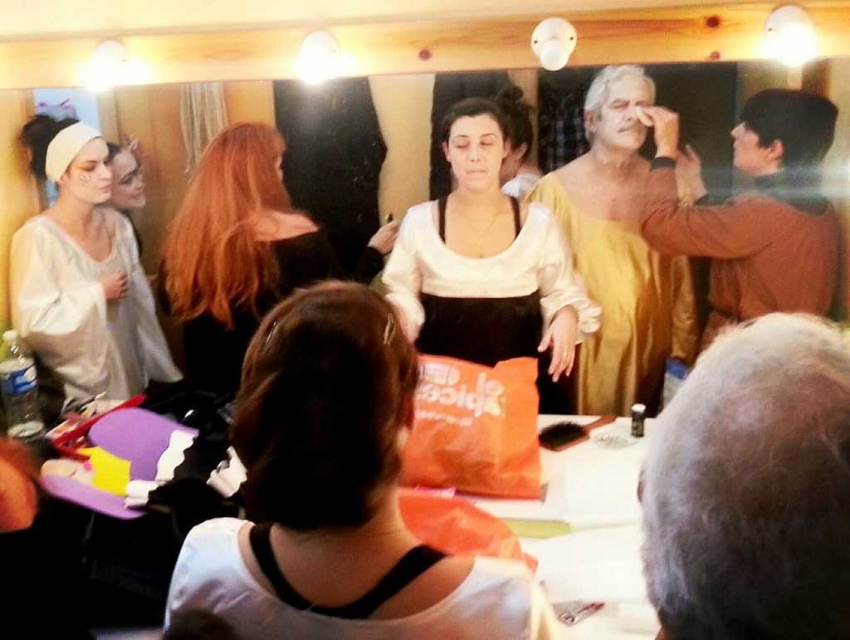
Question: Which object is farther from the camera taking this photo?

Choices:
 (A) white matte apron at center
 (B) black satin dress at center

Answer: (B)

Question: Which point is closer to the camera?

Choices:
 (A) (256, 296)
 (B) (429, 317)
 (C) (207, 548)

Answer: (C)

Question: Is white matte apron at center smaller than black satin dress at center?

Choices:
 (A) yes
 (B) no

Answer: (B)

Question: Can you confirm if white matte fabric at left is smaller than gold satin dress at center?

Choices:
 (A) yes
 (B) no

Answer: (B)

Question: Which of these objects is positioned closest to the shiny brown hair at center?

Choices:
 (A) white matte apron at center
 (B) orange fabric bag at center

Answer: (A)

Question: Can you confirm if shiny brown hair at center is smaller than white matte dress at lower center?

Choices:
 (A) no
 (B) yes

Answer: (A)